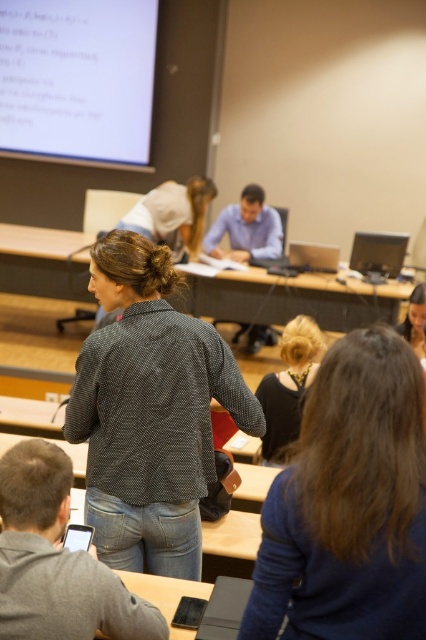
Which of these two, white matte projector screen at upper left or dark brown hair at center, stands shorter?

With less height is dark brown hair at center.

Is white matte projector screen at upper left wider than dark brown hair at center?

Indeed, white matte projector screen at upper left has a greater width compared to dark brown hair at center.

Locate an element on the screen. white matte projector screen at upper left is located at coordinates (77, 81).

Is point (296, 577) farther from viewer compared to point (140, 250)?

No, (296, 577) is closer to viewer.

Who is more forward, (261, 515) or (100, 353)?

Point (261, 515) is in front.

Find the location of a particular element. This screenshot has width=426, height=640. dark blue sweater at center is located at coordinates (348, 502).

Can you confirm if wooden table at center is bigger than dark brown hair at center?

Indeed, wooden table at center has a larger size compared to dark brown hair at center.

Is wooden table at center positioned at the back of dark brown hair at center?

Yes.

Locate an element on the screen. The image size is (426, 640). wooden table at center is located at coordinates (290, 298).